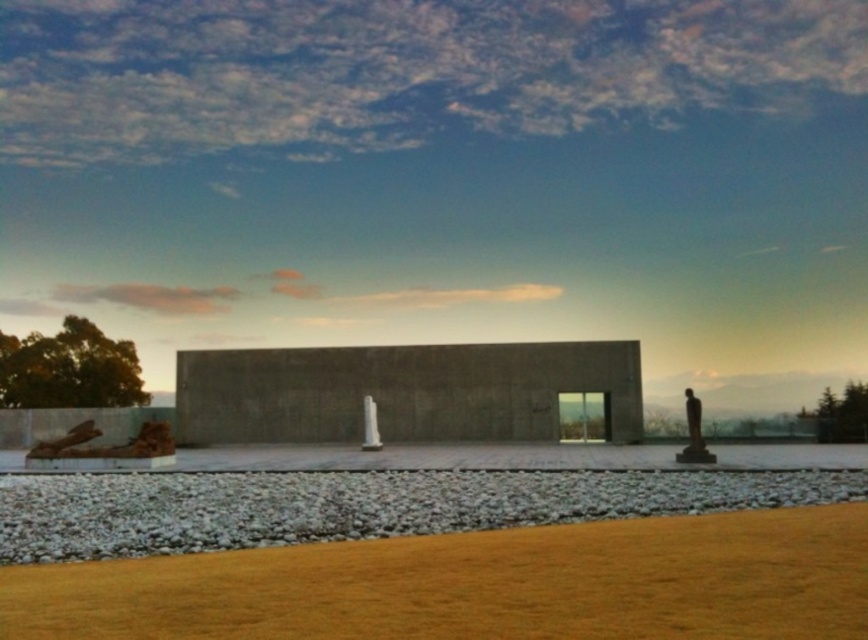
Question: Which object is positioned farthest from the white concrete column at center?

Choices:
 (A) polished bronze statue at right
 (B) wooden log at lower left

Answer: (A)

Question: Which point appears farthest from the camera in this image?

Choices:
 (A) (820, 484)
 (B) (77, 426)
 (C) (696, 438)

Answer: (B)

Question: Which point is farther to the camera?

Choices:
 (A) rustic wood log at lower left
 (B) polished bronze statue at right
 (C) dark gray concrete wall at center

Answer: (C)

Question: Can you confirm if rustic wood log at lower left is wider than polished bronze statue at right?

Choices:
 (A) yes
 (B) no

Answer: (A)

Question: Is rustic wood log at lower left further to camera compared to wooden log at lower left?

Choices:
 (A) no
 (B) yes

Answer: (A)

Question: Does white gravel at lower center have a larger size compared to dark gray concrete wall at center?

Choices:
 (A) no
 (B) yes

Answer: (A)